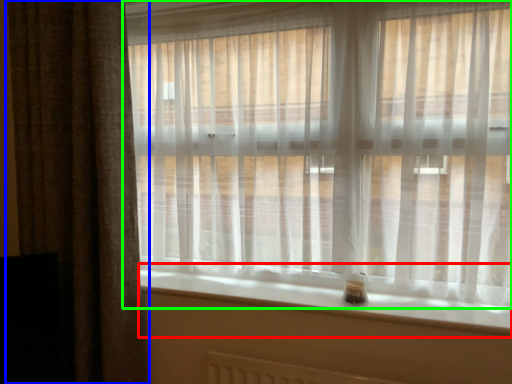
Question: Considering the real-world distances, which object is closest to window sill (highlighted by a red box)? curtain (highlighted by a blue box) or curtain (highlighted by a green box).

Choices:
 (A) curtain
 (B) curtain

Answer: (B)